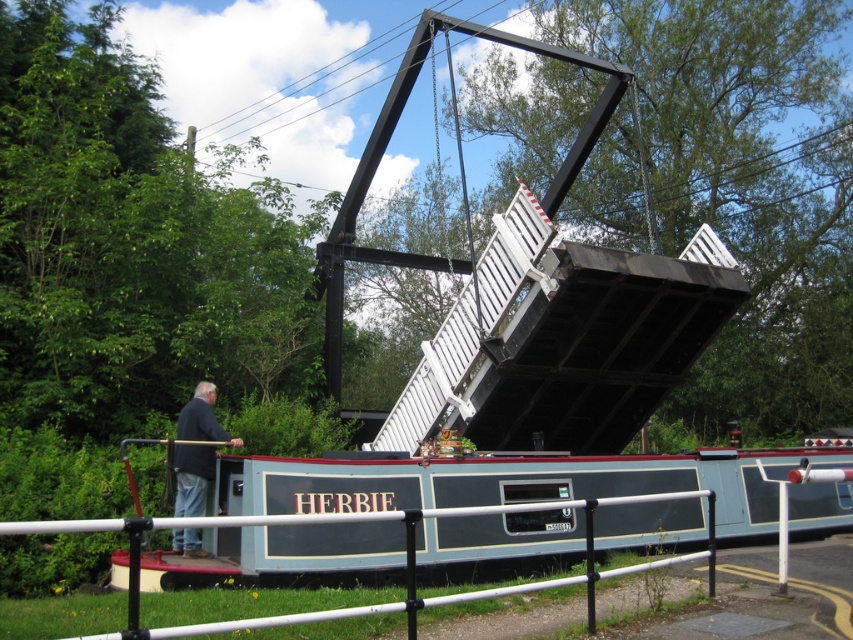
You are standing on the deck of the canal boat named HERBIE as it passes under the raised drawbridge. You notice a point marked at coordinate (453, 593). What object is located at this coordinate?

The point at coordinate (453, 593) marks the white metal rail at lower center.

You are standing on the deck of the canal boat Herbie as it passes under the raised drawbridge. You notice a white metal rail at lower center and a dark blue jacket at lower left. Which object is taller from your viewpoint?

The dark blue jacket at lower left is taller than the white metal rail at lower center.